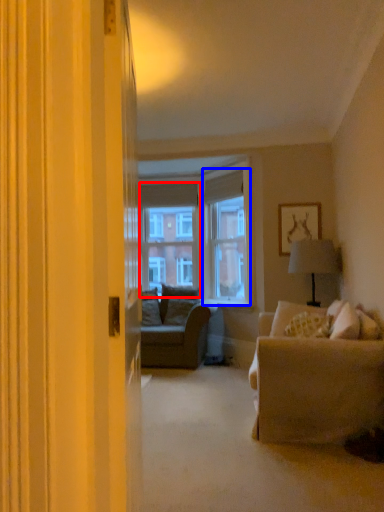
Question: Among these objects, which one is nearest to the camera, window screen (highlighted by a red box) or window screen (highlighted by a blue box)?

Choices:
 (A) window screen
 (B) window screen

Answer: (B)